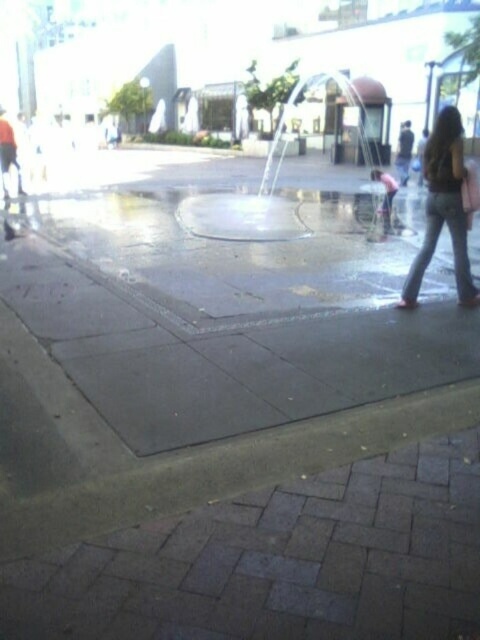
Question: Is transparent glass fountain at center bigger than denim jeans at right?

Choices:
 (A) no
 (B) yes

Answer: (B)

Question: Observing the image, what is the correct spatial positioning of transparent glass fountain at center in reference to denim jeans at right?

Choices:
 (A) below
 (B) above

Answer: (B)

Question: Which object is farther from the camera taking this photo?

Choices:
 (A) denim jeans at right
 (B) transparent glass fountain at center

Answer: (B)

Question: Which object is farther from the camera taking this photo?

Choices:
 (A) transparent glass fountain at center
 (B) denim jeans at right

Answer: (A)

Question: Is transparent glass fountain at center to the right of denim jeans at right from the viewer's perspective?

Choices:
 (A) no
 (B) yes

Answer: (B)